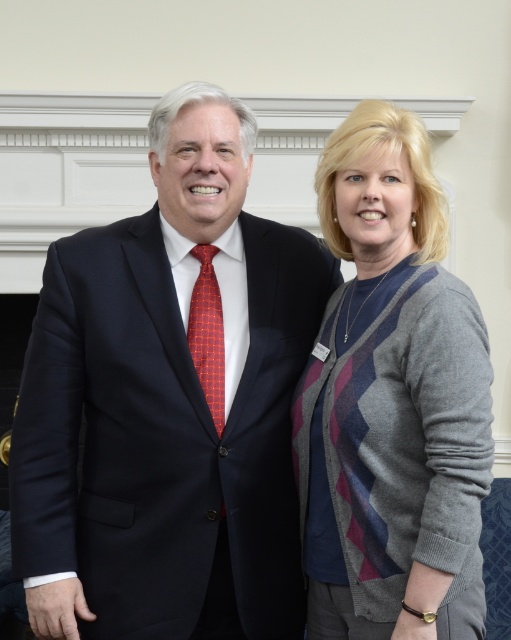
Which is more to the left, navy blue suit at left or red silk tie at center?

Positioned to the left is navy blue suit at left.

At what (x,y) coordinates should I click in order to perform the action: click on navy blue suit at left. Please return your answer as a coordinate pair (x, y). The image size is (511, 640). Looking at the image, I should click on (168, 404).

Find the location of a particular element. This screenshot has width=511, height=640. navy blue suit at left is located at coordinates (168, 404).

Where is `navy blue suit at left`? Image resolution: width=511 pixels, height=640 pixels. navy blue suit at left is located at coordinates pos(168,404).

Is point (187, 488) positioned before point (334, 332)?

Yes, it is.

Image resolution: width=511 pixels, height=640 pixels. Describe the element at coordinates (168, 404) in the screenshot. I see `navy blue suit at left` at that location.

What do you see at coordinates (168, 404) in the screenshot? The image size is (511, 640). I see `navy blue suit at left` at bounding box center [168, 404].

Locate an element on the screen. This screenshot has height=640, width=511. navy blue suit at left is located at coordinates (168, 404).

Is gray knit cardigan at center to the right of red silk tie at center from the viewer's perspective?

Indeed, gray knit cardigan at center is positioned on the right side of red silk tie at center.

Does gray knit cardigan at center lie in front of red silk tie at center?

Yes, gray knit cardigan at center is in front of red silk tie at center.

Is point (387, 188) less distant than point (188, 324)?

Yes, it is.

I want to click on gray knit cardigan at center, so click(391, 403).